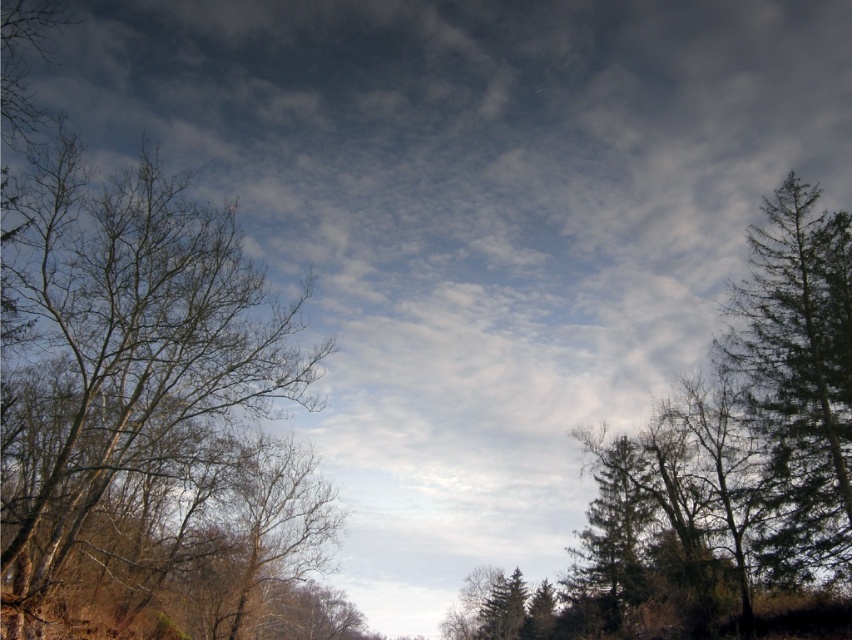
You are an observer looking at the scene. Which tree is positioned lower in the image, the brown leafless tree at left or the green textured tree at right?

The brown leafless tree at left is positioned lower in the image than the green textured tree at right.

You are an observer looking at the scene. There is a brown leafless tree at left and a point at coordinates [125,353]. Which object is located at the given coordinates?

The brown leafless tree at left is represented by point [125,353].